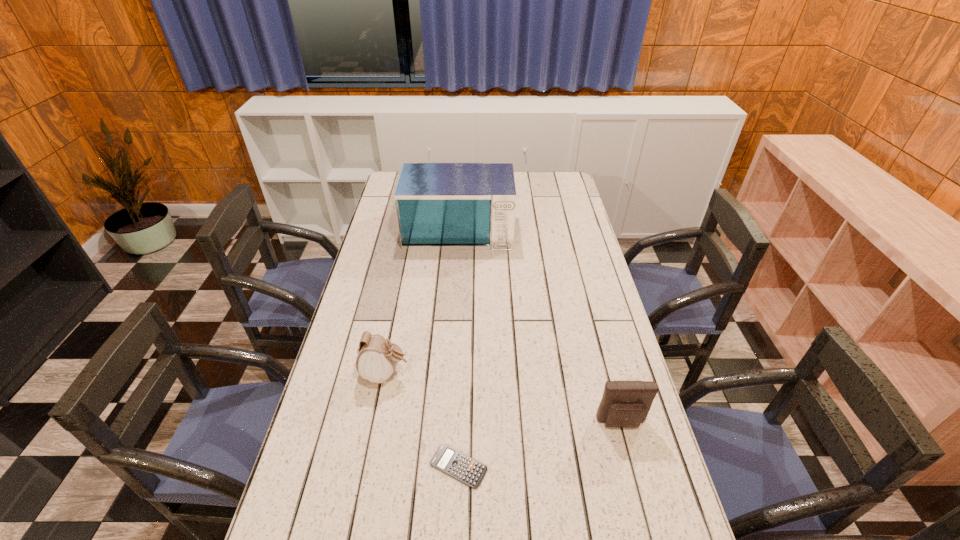
Locate an element on the screen. This screenshot has width=960, height=540. free location that satisfies the following two spatial constraints: 1. on the front-facing side of the calculator; 2. on the left side of the farther pouch is located at coordinates (368, 467).

Find the location of `free location that satisfies the following two spatial constraints: 1. on the front-facing side of the tallest object; 2. on the front-facing side of the second farthest object`. free location that satisfies the following two spatial constraints: 1. on the front-facing side of the tallest object; 2. on the front-facing side of the second farthest object is located at coordinates (449, 374).

At what (x,y) coordinates should I click in order to perform the action: click on vacant area in the image that satisfies the following two spatial constraints: 1. on the front-facing side of the left pouch; 2. on the back side of the calculator. Please return your answer as a coordinate pair (x, y). This screenshot has height=540, width=960. Looking at the image, I should click on (368, 467).

You are a GUI agent. You are given a task and a screenshot of the screen. Output one action in this format:
    pyautogui.click(x=<x>, y=<y>)
    Task: Click on the blank area in the image that satisfies the following two spatial constraints: 1. on the front-facing side of the tallest object; 2. on the left side of the nearest object
    
    Given the screenshot: What is the action you would take?
    pyautogui.click(x=444, y=467)

The height and width of the screenshot is (540, 960). I want to click on free spot that satisfies the following two spatial constraints: 1. on the front-facing side of the farthest object; 2. on the left side of the shortest object, so click(x=444, y=467).

You are a GUI agent. You are given a task and a screenshot of the screen. Output one action in this format:
    pyautogui.click(x=<x>, y=<y>)
    Task: Click on the free point that satisfies the following two spatial constraints: 1. on the front-facing side of the farther pouch; 2. on the right side of the shortest object
    The width and height of the screenshot is (960, 540).
    Given the screenshot: What is the action you would take?
    pyautogui.click(x=368, y=467)

I want to click on free spot that satisfies the following two spatial constraints: 1. on the front-facing side of the microwave oven; 2. on the front-facing side of the left pouch, so click(x=449, y=374).